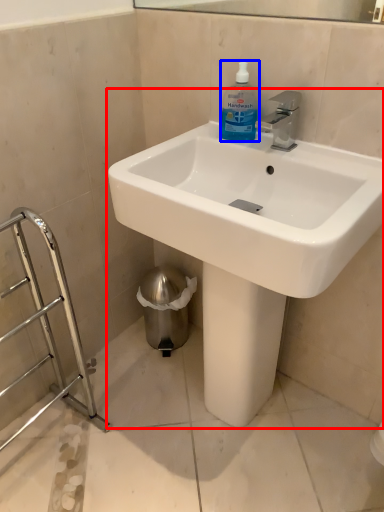
Question: Which object is closer to the camera taking this photo, sink (highlighted by a red box) or cleaning product (highlighted by a blue box)?

Choices:
 (A) sink
 (B) cleaning product

Answer: (A)